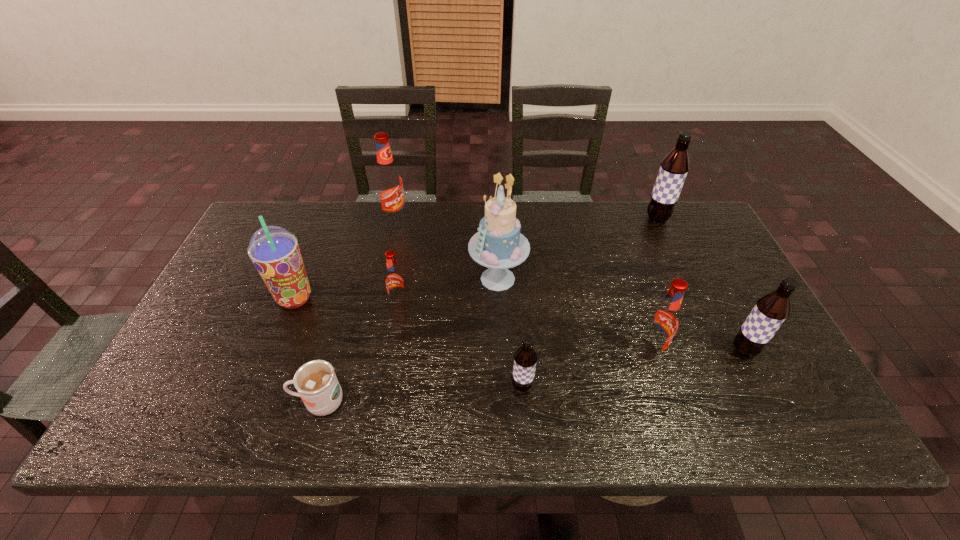
Where is `vacant region at the right edge of the desktop`? This screenshot has width=960, height=540. vacant region at the right edge of the desktop is located at coordinates pos(699,258).

This screenshot has height=540, width=960. In order to click on vacant space at the far right corner of the desktop in this screenshot , I will do `click(681, 211)`.

Where is `free space at the near right corner of the desktop`? free space at the near right corner of the desktop is located at coordinates [x=825, y=433].

Where is `blank region between the nearest root beer and the farthest red root beer`? blank region between the nearest root beer and the farthest red root beer is located at coordinates (459, 303).

Locate an element on the screen. The image size is (960, 540). vacant area between the blue cake and the smallest red root beer is located at coordinates (448, 291).

Find the location of `free space between the biggest brown root beer and the cake`. free space between the biggest brown root beer and the cake is located at coordinates click(578, 248).

This screenshot has width=960, height=540. I want to click on vacant area that lies between the shortest object and the cake, so click(x=409, y=341).

Image resolution: width=960 pixels, height=540 pixels. Find the location of `free space between the rightmost red root beer and the smallest brown root beer`. free space between the rightmost red root beer and the smallest brown root beer is located at coordinates (586, 369).

Locate an element on the screen. free space between the shortest object and the biggest brown root beer is located at coordinates (489, 310).

At what (x,y) coordinates should I click in order to perform the action: click on vacant space that's between the second farthest brown root beer and the rightmost red root beer. Please return your answer as a coordinate pair (x, y). Looking at the image, I should click on (697, 351).